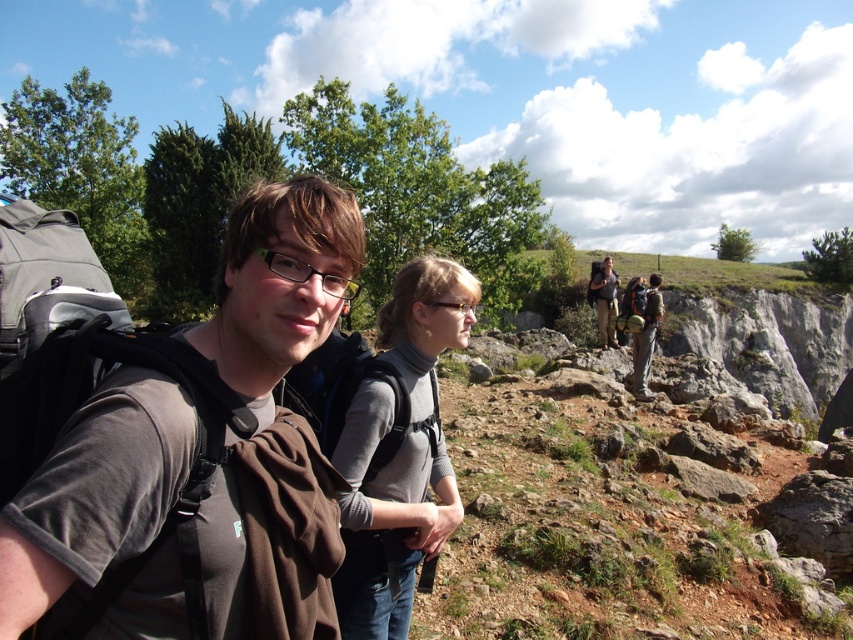
Which is in front, point (265, 269) or point (352, 490)?

Point (265, 269) is in front.

Which is below, dark gray fabric backpack at left or gray wool sweater at center?

gray wool sweater at center is below.

Where is `dark gray fabric backpack at left`? dark gray fabric backpack at left is located at coordinates (183, 451).

Find the location of a particular element. dark gray fabric backpack at left is located at coordinates (183, 451).

Is gray wool sweater at center wider than khaki cotton pants at center?

In fact, gray wool sweater at center might be narrower than khaki cotton pants at center.

Who is lower down, gray wool sweater at center or khaki cotton pants at center?

gray wool sweater at center is below.

Who is more distant from viewer, (381,307) or (604,346)?

The point (604,346) is behind.

Where is `gray wool sweater at center`? The width and height of the screenshot is (853, 640). gray wool sweater at center is located at coordinates point(399,452).

Can you confirm if dark gray fabric backpack at left is bigger than khaki cotton pants at center?

Incorrect, dark gray fabric backpack at left is not larger than khaki cotton pants at center.

Which is in front, point (199, 364) or point (607, 314)?

Point (199, 364)

Identify the location of dark gray fabric backpack at left. (183, 451).